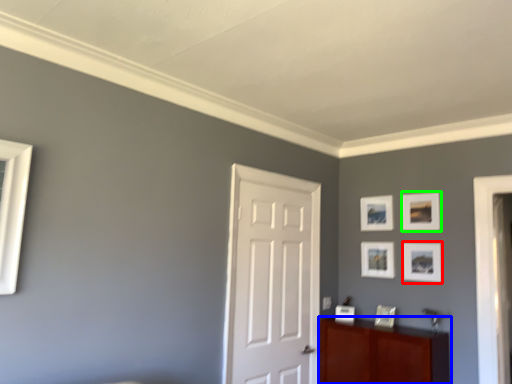
Question: Which is farther away from picture frame (highlighted by a red box)? cabinetry (highlighted by a blue box) or picture frame (highlighted by a green box)?

Choices:
 (A) cabinetry
 (B) picture frame

Answer: (A)